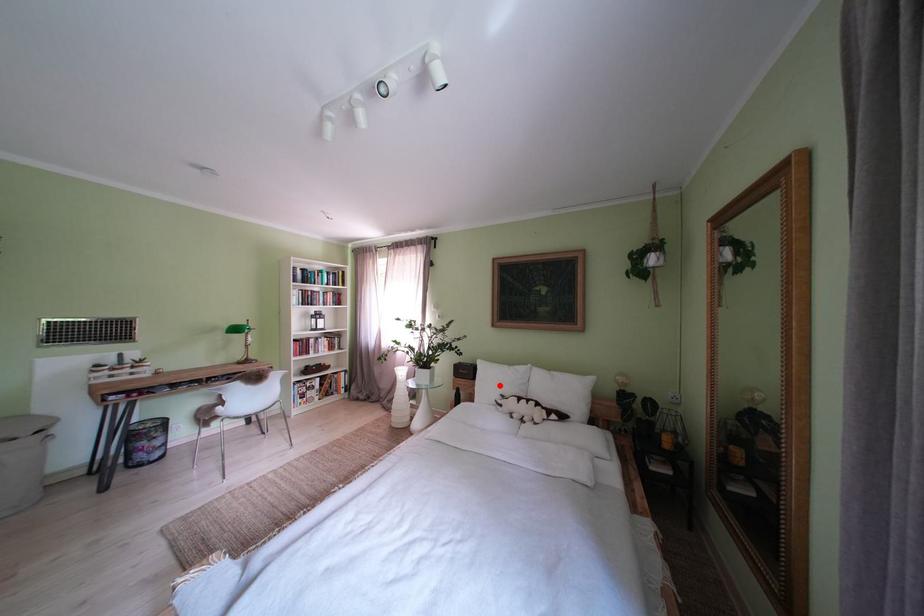
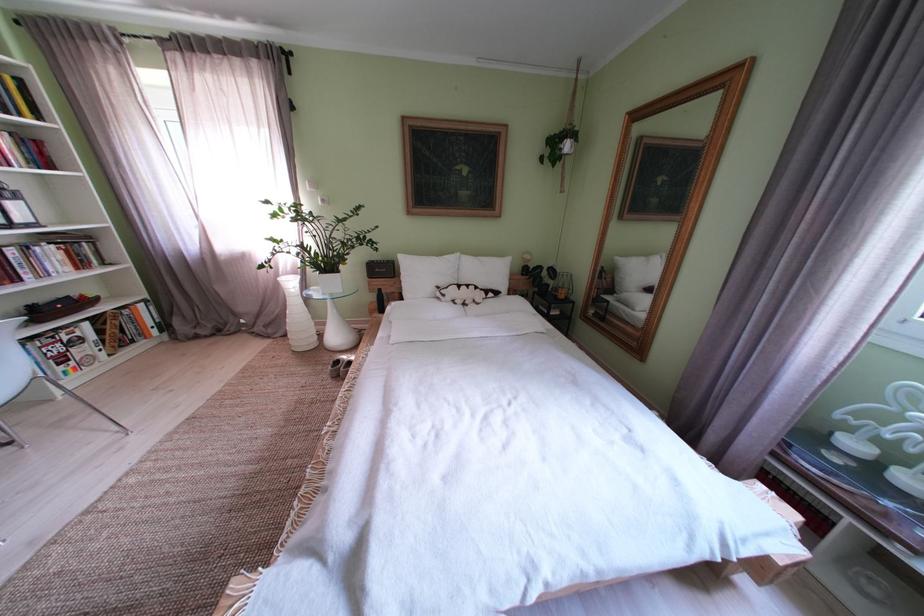
Question: A red point is marked in image1. In image2, is the corresponding 3D point closer to the camera or farther? Reply with the corresponding letter.

Choices:
 (A) The corresponding 3D point is closer.
 (B) The corresponding 3D point is farther.

Answer: (A)